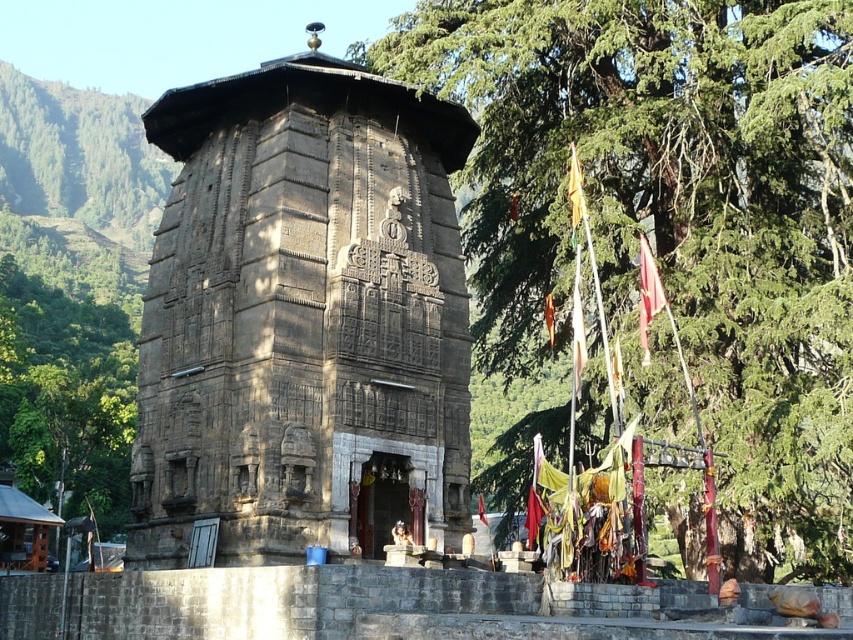
Which is in front, point (840, 156) or point (331, 179)?

Point (331, 179)

Does green leafy tree at upper center appear under brown stone temple at center?

Actually, green leafy tree at upper center is above brown stone temple at center.

Who is more forward, [735,538] or [300,413]?

Point [300,413] is more forward.

Where is `green leafy tree at upper center`? This screenshot has width=853, height=640. green leafy tree at upper center is located at coordinates (674, 224).

Does point (390, 244) lie behind point (100, 508)?

That is False.

Is brown stone temple at center taller than green leafy tree at center?

No, brown stone temple at center is not taller than green leafy tree at center.

Identify the location of brown stone temple at center. (302, 317).

How much distance is there between green leafy tree at upper center and green leafy tree at center?

green leafy tree at upper center and green leafy tree at center are 61.63 meters apart.

Who is shorter, green leafy tree at upper center or green leafy tree at center?

green leafy tree at center is shorter.

Is point (816, 19) in front of point (103, 346)?

That is True.

The height and width of the screenshot is (640, 853). I want to click on green leafy tree at upper center, so click(674, 224).